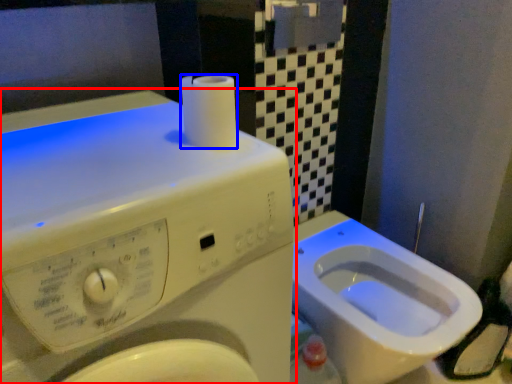
Question: Which point is further to the camera, washing machine (highlighted by a red box) or toilet paper (highlighted by a blue box)?

Choices:
 (A) washing machine
 (B) toilet paper

Answer: (B)